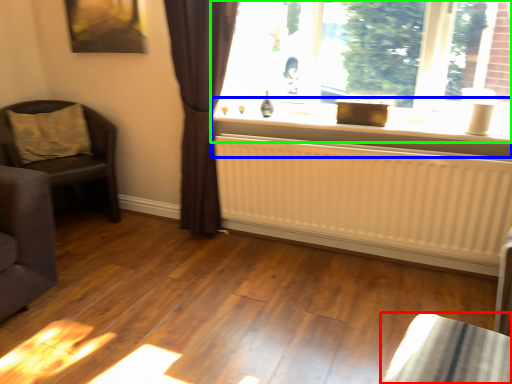
Question: Based on their relative distances, which object is nearer to furniture (highlighted by a red box)? Choose from window sill (highlighted by a blue box) and window (highlighted by a green box).

Choices:
 (A) window sill
 (B) window

Answer: (A)